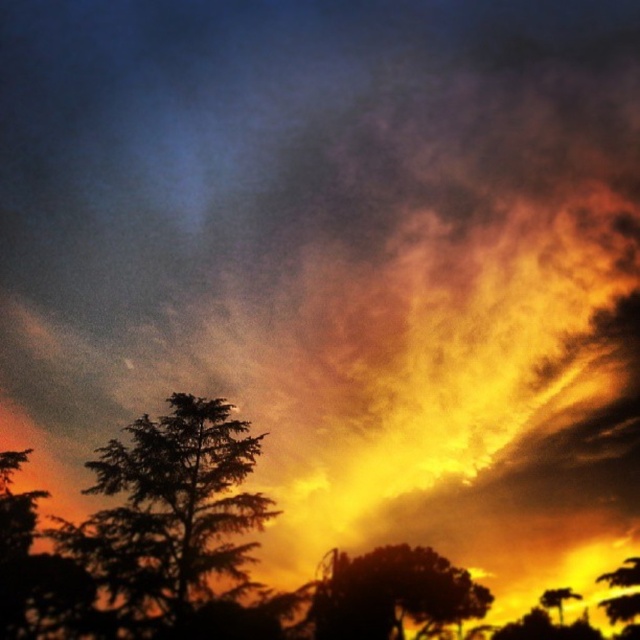
Is silhouette tree at left in front of silky green leafy tree at lower right?

Yes, silhouette tree at left is in front of silky green leafy tree at lower right.

Who is more forward, (172, 573) or (547, 609)?

Positioned in front is point (172, 573).

This screenshot has width=640, height=640. Describe the element at coordinates (173, 504) in the screenshot. I see `silhouette tree at left` at that location.

What are the coordinates of `silhouette tree at left` in the screenshot? It's located at (173, 504).

Looking at this image, who is more forward, (634,561) or (540,602)?

Positioned in front is point (540,602).

Between silky brown tree at lower right and silky green leafy tree at lower right, which one has less height?

silky green leafy tree at lower right is shorter.

You are a GUI agent. You are given a task and a screenshot of the screen. Output one action in this format:
    pyautogui.click(x=<x>, y=<y>)
    Task: Click on the silky brown tree at lower right
    This screenshot has height=640, width=640.
    Given the screenshot: What is the action you would take?
    pyautogui.click(x=621, y=605)

Based on the photo, can you confirm if silhouette tree at left is wider than silky brown tree at lower right?

Yes, silhouette tree at left is wider than silky brown tree at lower right.

Looking at this image, who is shorter, silhouette tree at left or silky brown tree at lower right?

Standing shorter between the two is silky brown tree at lower right.

Between point (161, 532) and point (636, 582), which one is positioned behind?

The point (636, 582) is behind.

What are the coordinates of `silhouette tree at left` in the screenshot? It's located at (173, 504).